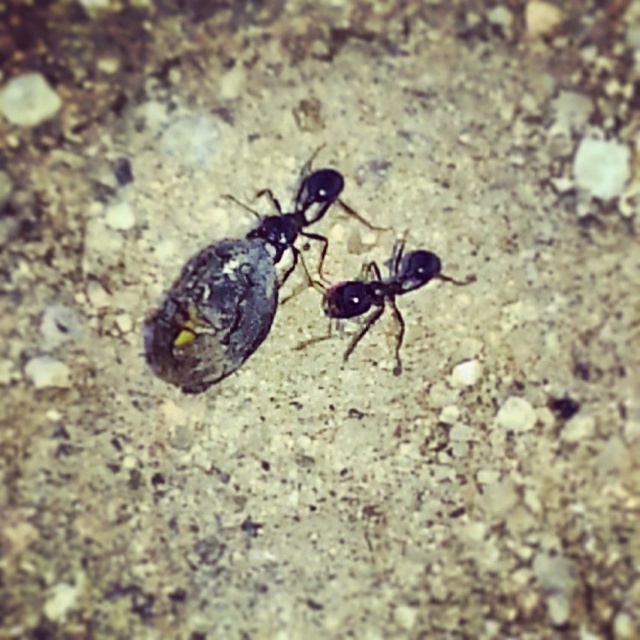
Question: Is black matte ant at center thinner than black glossy ant at center?

Choices:
 (A) yes
 (B) no

Answer: (B)

Question: Which point is farther to the camera?

Choices:
 (A) (371, 323)
 (B) (218, 273)

Answer: (A)

Question: Can you confirm if black matte ant at center is smaller than black glossy ant at center?

Choices:
 (A) no
 (B) yes

Answer: (A)

Question: Can you confirm if black matte ant at center is smaller than black glossy ant at center?

Choices:
 (A) no
 (B) yes

Answer: (A)

Question: Among these objects, which one is nearest to the camera?

Choices:
 (A) black glossy ant at center
 (B) black matte ant at center

Answer: (B)